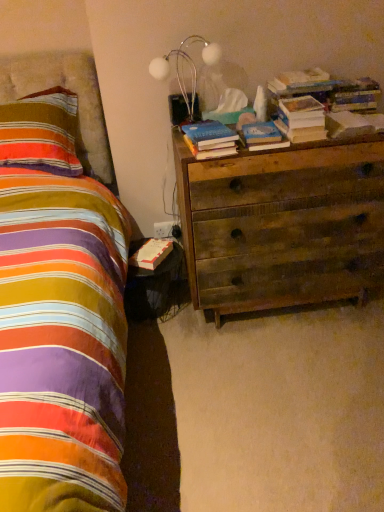
Locate an element on the screen. Image resolution: width=384 pixels, height=512 pixels. free space between hardcover book at upper right, which ranks as the second paperback book in back-to-front order, and hardcover book at upper right, the second book from the left is located at coordinates (350, 135).